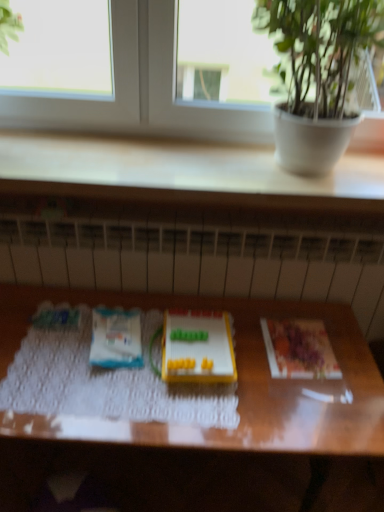
Image resolution: width=384 pixels, height=512 pixels. In order to click on free space above wooden table at center (from a real-world perspective) in this screenshot , I will do `click(153, 351)`.